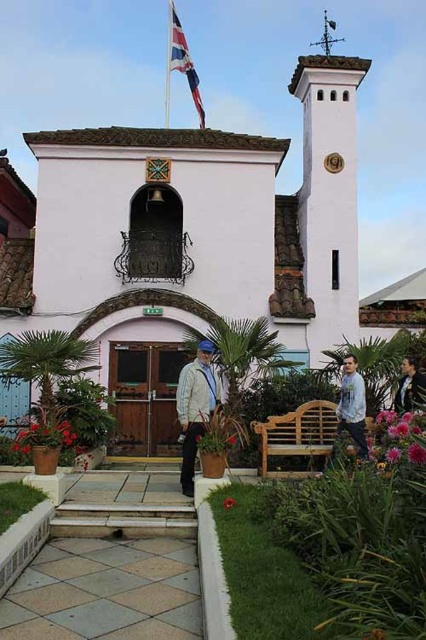
Does white stucco church at center have a lesser width compared to union jack fabric flag at upper center?

No.

Is white stucco church at center further to camera compared to union jack fabric flag at upper center?

That is False.

What are the coordinates of `white stucco church at center` in the screenshot? It's located at (189, 241).

Which is more to the left, light brown leather jacket at lower right or white painted wood spire at upper center?

From the viewer's perspective, light brown leather jacket at lower right appears more on the left side.

Is point (405, 356) behind point (325, 49)?

No, it is in front of (325, 49).

This screenshot has width=426, height=640. What do you see at coordinates (408, 385) in the screenshot?
I see `light brown leather jacket at lower right` at bounding box center [408, 385].

You are a GUI agent. You are given a task and a screenshot of the screen. Output one action in this format:
    pyautogui.click(x=<x>, y=<y>)
    Task: Click on the light brown leather jacket at lower right
    This screenshot has width=426, height=640.
    Given the screenshot: What is the action you would take?
    pyautogui.click(x=408, y=385)

Is point (241, 179) less distant than point (213, 394)?

No, it is not.

Can you confirm if white stucco church at center is positioned to the left of light beige jacket at center?

No, white stucco church at center is not to the left of light beige jacket at center.

Between point (351, 237) and point (184, 454), which one is positioned in front?

Positioned in front is point (184, 454).

You are a GUI agent. You are given a task and a screenshot of the screen. Output one action in this format:
    pyautogui.click(x=<x>, y=<y>)
    Task: Click on the white stucco church at center
    The width and height of the screenshot is (426, 640).
    Given the screenshot: What is the action you would take?
    pyautogui.click(x=189, y=241)